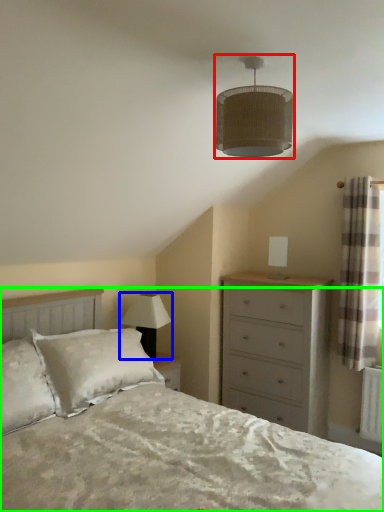
Question: Based on their relative distances, which object is farther from lamp (highlighted by a red box)? Choose from lamp (highlighted by a blue box) and bed (highlighted by a green box).

Choices:
 (A) lamp
 (B) bed

Answer: (A)